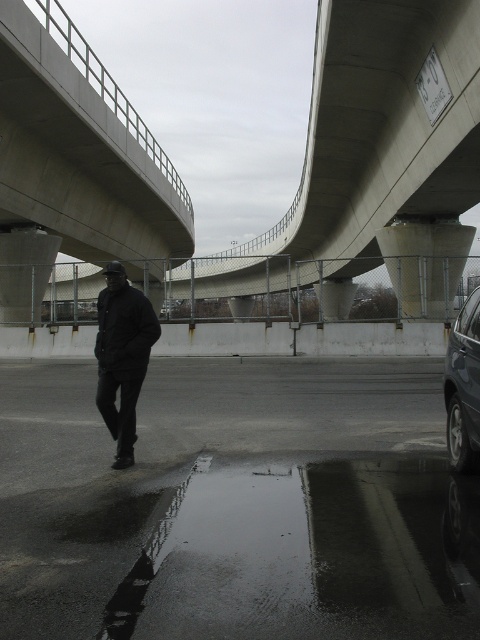
Between concrete at center and black matte jacket at center, which one has more height?

With more height is concrete at center.

Does concrete at center appear on the left side of black matte jacket at center?

Yes, concrete at center is to the left of black matte jacket at center.

I want to click on concrete at center, so click(x=300, y=173).

The width and height of the screenshot is (480, 640). Identify the location of concrete at center. tap(300, 173).

Can you confirm if concrete at center is positioned to the left of shiny black suv at right?

Indeed, concrete at center is positioned on the left side of shiny black suv at right.

Can you confirm if concrete at center is positioned to the right of shiny black suv at right?

Incorrect, concrete at center is not on the right side of shiny black suv at right.

This screenshot has height=640, width=480. In order to click on concrete at center in this screenshot , I will do pyautogui.click(x=300, y=173).

I want to click on concrete at center, so click(300, 173).

You are a GUI agent. You are given a task and a screenshot of the screen. Output one action in this format:
    pyautogui.click(x=<x>, y=<y>)
    Task: Click on the glossy asphalt highway at lower left
    The height and width of the screenshot is (640, 480).
    Given the screenshot: What is the action you would take?
    pyautogui.click(x=236, y=502)

Is glossy asphalt highway at lower left below concrete at center?

Correct, glossy asphalt highway at lower left is located below concrete at center.

Locate an element on the screen. glossy asphalt highway at lower left is located at coordinates (236, 502).

What are the coordinates of `glossy asphalt highway at lower left` in the screenshot? It's located at (236, 502).